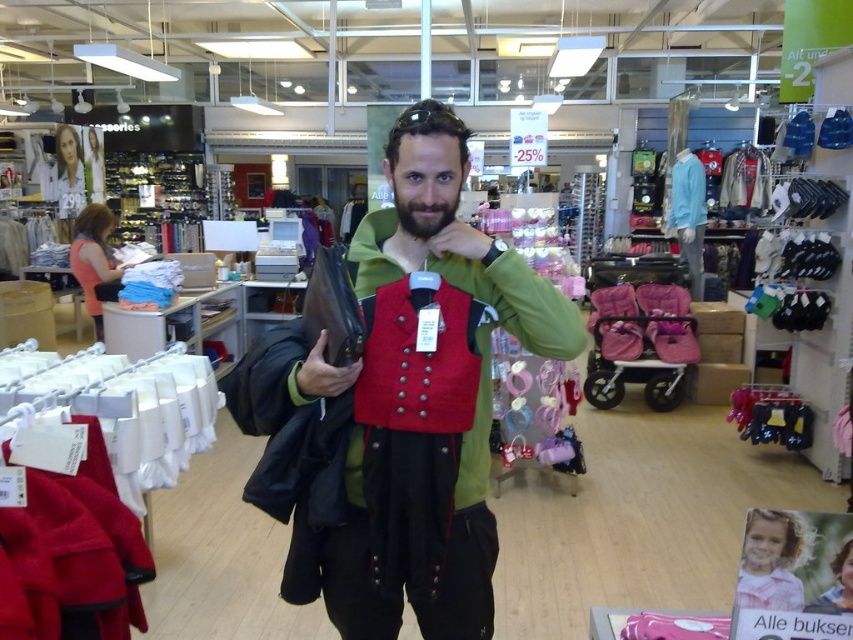
You are standing in the retail store and want to determine the relative positions of two points marked in the image. Which point is closer to you, point (468, 545) or point (405, 205)?

Point (468, 545) is further to the viewer than point (405, 205), so point (405, 205) is closer to you.

You are a store employee observing a customer in the center of the frame. You notice the matte red vest at center and the beardhairjaw at center. Which object is closer to you from your perspective?

The matte red vest at center is in front of the beardhairjaw at center, so the matte red vest at center is closer to you.

Based on the photo, you are a store employee observing a customer in the center of the frame. The customer is wearing a matte red vest at center and has beardhairjaw at center. Which item of the customer is bigger in size?

The matte red vest at center is larger in size than the beardhairjaw at center.